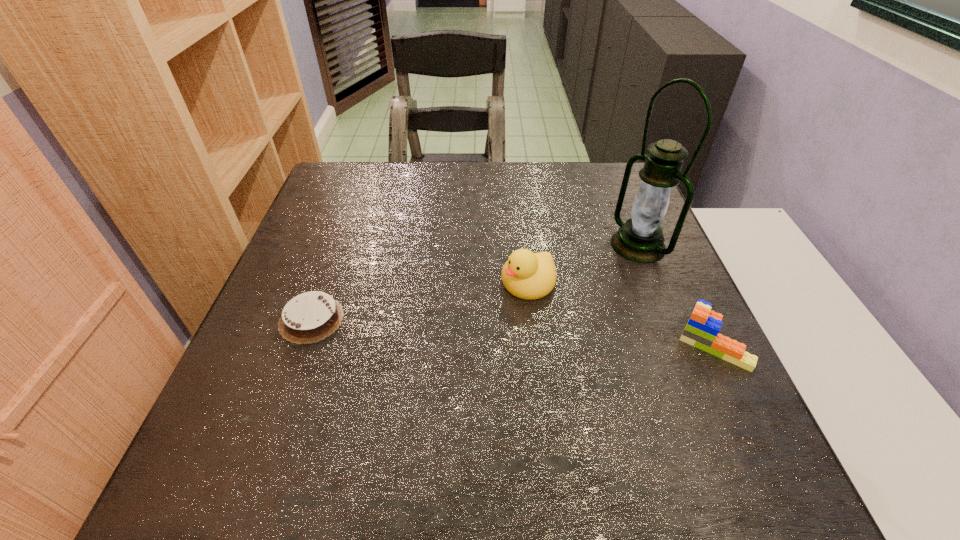
You are a GUI agent. You are given a task and a screenshot of the screen. Output one action in this format:
    pyautogui.click(x=<x>, y=<y>)
    Task: Click on the free area in between the shortest object and the Lego
    The image size is (960, 540).
    Given the screenshot: What is the action you would take?
    pyautogui.click(x=512, y=330)

The width and height of the screenshot is (960, 540). In order to click on empty space that is in between the chocolate cake and the second object from left to right in this screenshot , I will do tap(420, 301).

Find the location of a particular element. free spot between the chocolate cake and the lantern is located at coordinates (475, 282).

The height and width of the screenshot is (540, 960). Identify the location of object that ranks as the second closest to the tallest object. (527, 275).

This screenshot has width=960, height=540. Find the location of `the second closest object relative to the tallest object`. the second closest object relative to the tallest object is located at coordinates (527, 275).

The width and height of the screenshot is (960, 540). Find the location of `free space that satisfies the following two spatial constraints: 1. on the back side of the chocolate cake; 2. on the left side of the second object from left to right`. free space that satisfies the following two spatial constraints: 1. on the back side of the chocolate cake; 2. on the left side of the second object from left to right is located at coordinates (324, 282).

The width and height of the screenshot is (960, 540). In order to click on free space that satisfies the following two spatial constraints: 1. on the back side of the tallest object; 2. on the right side of the duckling in this screenshot , I will do `click(524, 245)`.